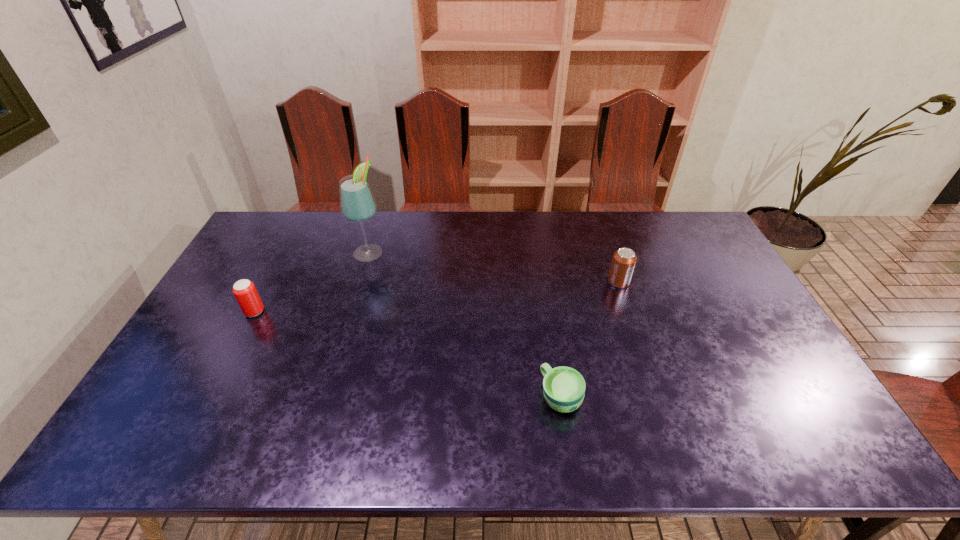
The height and width of the screenshot is (540, 960). In order to click on the farthest object in this screenshot , I will do `click(357, 204)`.

Where is `alcohol`? alcohol is located at coordinates (357, 204).

This screenshot has height=540, width=960. Identify the location of the second farthest object. (623, 262).

The image size is (960, 540). What are the coordinates of `can` in the screenshot? It's located at (623, 262).

The height and width of the screenshot is (540, 960). I want to click on the third farthest object, so click(x=244, y=290).

The width and height of the screenshot is (960, 540). Find the location of `the leftmost object`. the leftmost object is located at coordinates (244, 290).

I want to click on the shortest object, so click(564, 388).

At what (x,y) coordinates should I click in order to perform the action: click on the nearest object. Please return your answer as a coordinate pair (x, y). This screenshot has height=540, width=960. Looking at the image, I should click on (564, 388).

Locate an element on the screen. vacant space located on the left of the alcohol is located at coordinates tap(306, 252).

At what (x,y) coordinates should I click in order to perform the action: click on free region located on the front of the second farthest object. Please return your answer as a coordinate pair (x, y). Image resolution: width=960 pixels, height=540 pixels. Looking at the image, I should click on (627, 307).